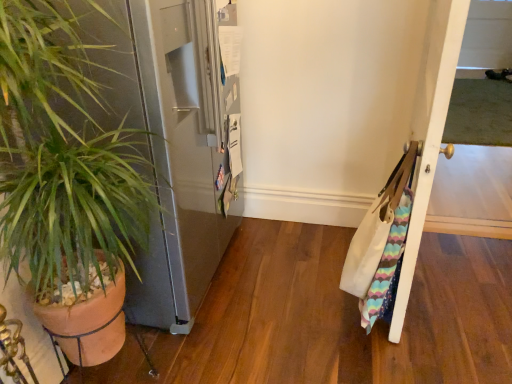
Question: Does point (444, 23) appear closer or farther from the camera than point (1, 48)?

Choices:
 (A) closer
 (B) farther

Answer: (B)

Question: In terms of height, does white wood door at right look taller or shorter compared to green leafy plant in terracotta pot at left?

Choices:
 (A) tall
 (B) short

Answer: (B)

Question: Based on their positions, is white wood door at right located to the left or right of green leafy plant in terracotta pot at left?

Choices:
 (A) left
 (B) right

Answer: (B)

Question: Considering the positions of point (41, 1) and point (430, 23), is point (41, 1) closer or farther from the camera than point (430, 23)?

Choices:
 (A) farther
 (B) closer

Answer: (B)

Question: Considering the relative positions of green leafy plant in terracotta pot at left and white wood door at right in the image provided, is green leafy plant in terracotta pot at left to the left or to the right of white wood door at right?

Choices:
 (A) left
 (B) right

Answer: (A)

Question: In terms of width, does green leafy plant in terracotta pot at left look wider or thinner when compared to white wood door at right?

Choices:
 (A) wide
 (B) thin

Answer: (A)

Question: Considering the positions of green leafy plant in terracotta pot at left and white wood door at right in the image, is green leafy plant in terracotta pot at left taller or shorter than white wood door at right?

Choices:
 (A) tall
 (B) short

Answer: (A)